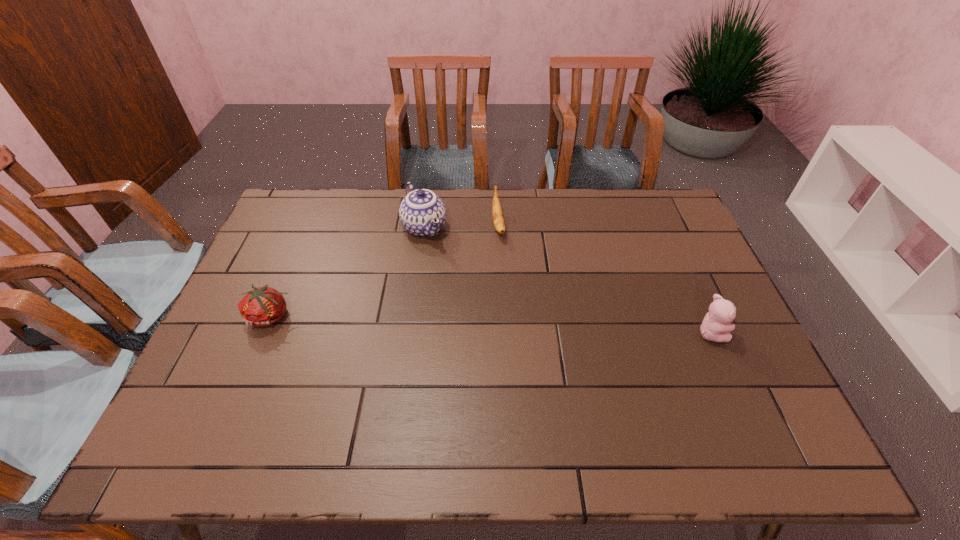
The width and height of the screenshot is (960, 540). Find the location of `vacant space located from the spout of the tallest object`. vacant space located from the spout of the tallest object is located at coordinates (450, 279).

Locate an element on the screen. vacant space located 0.270m from the spout of the tallest object is located at coordinates (467, 306).

Where is `vacant space situated from the spout of the tallest object`? vacant space situated from the spout of the tallest object is located at coordinates (461, 297).

What are the coordinates of `banana that is at the far edge` in the screenshot? It's located at 498,220.

Identify the location of chinaware at the far edge. (422, 213).

Find the location of `object that is at the left edge`. object that is at the left edge is located at coordinates (263, 306).

Locate an element on the screen. object that is at the right edge is located at coordinates (716, 326).

Where is `free region at the far edge of the desktop`? This screenshot has width=960, height=540. free region at the far edge of the desktop is located at coordinates (386, 230).

Where is `vacant space at the near edge of the desktop`? vacant space at the near edge of the desktop is located at coordinates (583, 402).

Where is `vacant space at the far right corner`? vacant space at the far right corner is located at coordinates (634, 197).